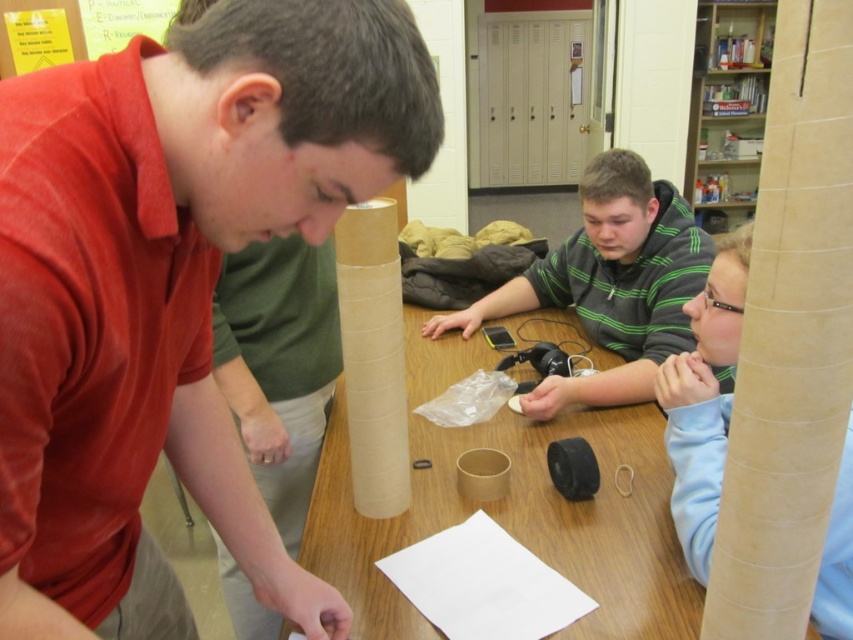
Is matte cardboard tube at center positioned before matte cardboard tube at right?

Yes, matte cardboard tube at center is in front of matte cardboard tube at right.

Between matte cardboard tube at center and matte cardboard tube at right, which one has more height?

matte cardboard tube at center is taller.

Between point (207, 70) and point (718, 326), which one is positioned in front?

Positioned in front is point (207, 70).

This screenshot has width=853, height=640. Identify the location of matte cardboard tube at center. (170, 285).

Does brown cardboard table at center appear over matte cardboard tube at right?

No.

Can you confirm if brown cardboard table at center is shorter than matte cardboard tube at right?

Indeed, brown cardboard table at center has a lesser height compared to matte cardboard tube at right.

In order to click on brown cardboard table at center in this screenshot , I will do `click(509, 508)`.

Where is `matte cardboard tube at right`? Image resolution: width=853 pixels, height=640 pixels. matte cardboard tube at right is located at coordinates (703, 401).

Which of these two, matte cardboard tube at right or brown cardboard tube at center, stands taller?

Standing taller between the two is matte cardboard tube at right.

The width and height of the screenshot is (853, 640). What do you see at coordinates (703, 401) in the screenshot?
I see `matte cardboard tube at right` at bounding box center [703, 401].

Image resolution: width=853 pixels, height=640 pixels. Identify the location of matte cardboard tube at right. click(703, 401).